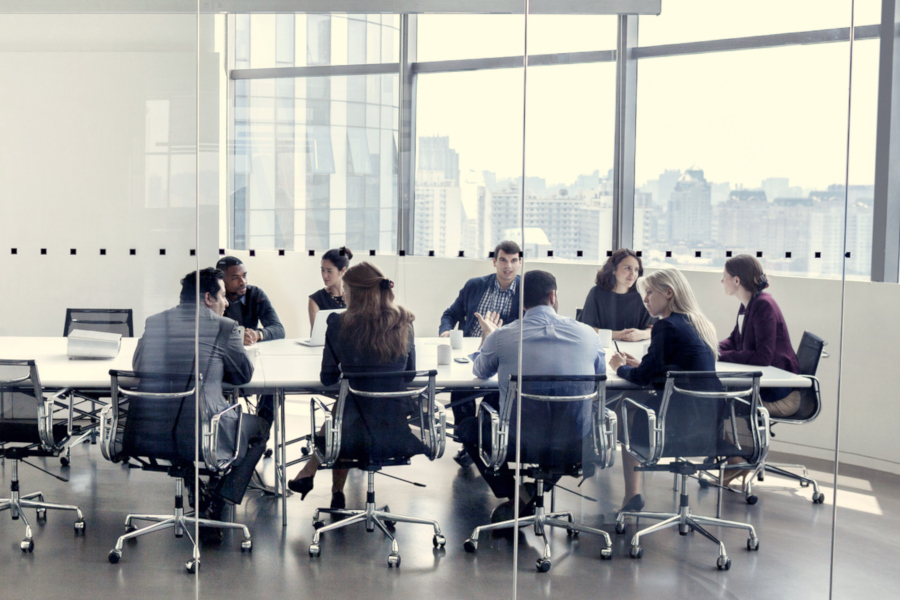
The height and width of the screenshot is (600, 900). Find the location of `chairs`. chairs is located at coordinates (9, 408), (144, 418), (392, 442), (550, 438), (722, 423), (816, 354), (580, 315), (104, 320).